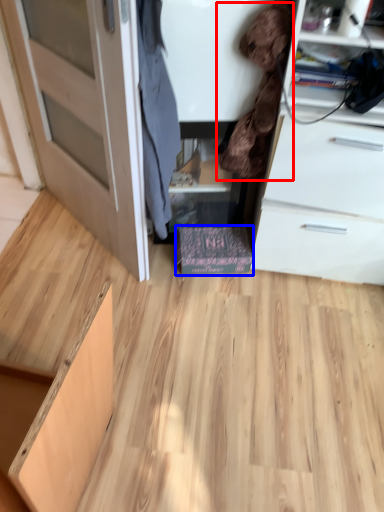
Question: Which object appears closest to the camera in this image, clothing (highlighted by a red box) or cabinetry (highlighted by a blue box)?

Choices:
 (A) clothing
 (B) cabinetry

Answer: (A)